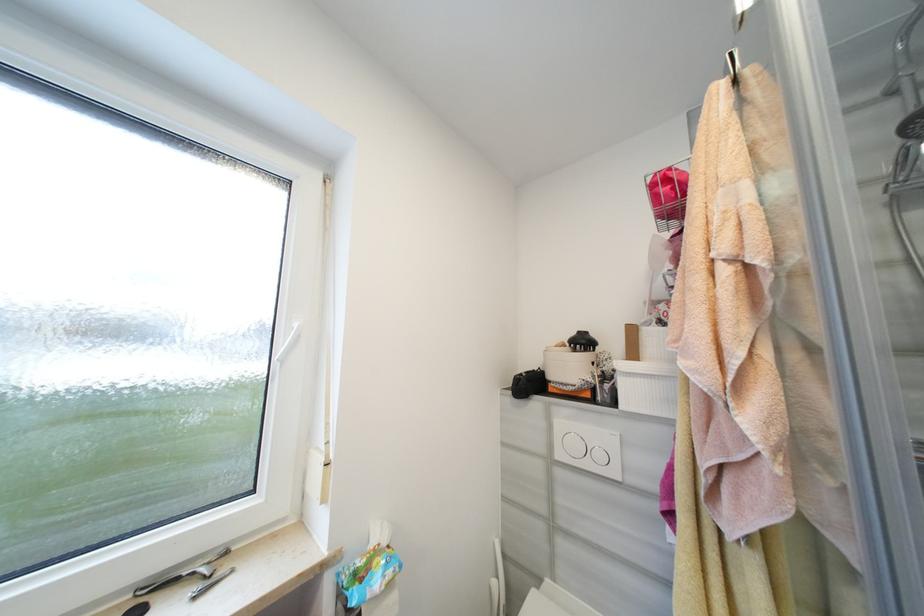
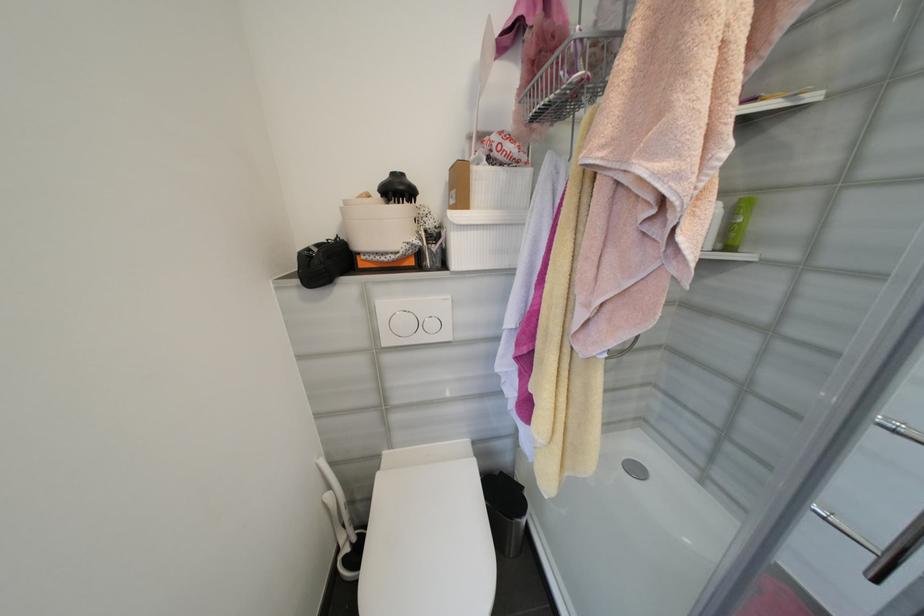
How did the camera likely rotate?

The camera rotated toward right-down.